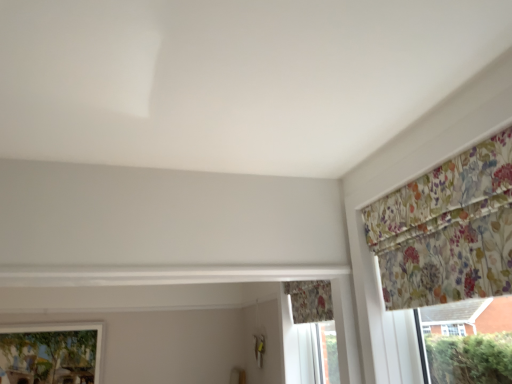
Question: Is floral fabric curtain at lower center, positioned as the 2th curtain in front-to-back order, turned away from floral fabric curtain at upper right, positioned as the 1th curtain in top-to-bottom order?

Choices:
 (A) yes
 (B) no

Answer: (B)

Question: Is floral fabric curtain at lower center, marked as the 2th curtain in a right-to-left arrangement, thinner than floral fabric curtain at upper right, acting as the 2th curtain starting from the left?

Choices:
 (A) no
 (B) yes

Answer: (B)

Question: Does floral fabric curtain at lower center, positioned as the 2th curtain in front-to-back order, appear on the left side of floral fabric curtain at upper right, the first curtain positioned from the right?

Choices:
 (A) no
 (B) yes

Answer: (B)

Question: From a real-world perspective, is floral fabric curtain at lower center, marked as the 2th curtain in a right-to-left arrangement, under floral fabric curtain at upper right, acting as the 2th curtain starting from the left?

Choices:
 (A) no
 (B) yes

Answer: (B)

Question: Does floral fabric curtain at lower center, which ranks as the first curtain in bottom-to-top order, have a smaller size compared to floral fabric curtain at upper right, positioned as the 1th curtain in top-to-bottom order?

Choices:
 (A) yes
 (B) no

Answer: (A)

Question: From their relative heights in the image, would you say matte glass window at lower left is taller or shorter than floral fabric curtain at lower center, which is the second curtain in top-to-bottom order?

Choices:
 (A) short
 (B) tall

Answer: (B)

Question: Does point (83, 345) appear closer or farther from the camera than point (301, 312)?

Choices:
 (A) closer
 (B) farther

Answer: (B)

Question: Based on their sizes in the image, would you say matte glass window at lower left is bigger or smaller than floral fabric curtain at lower center, positioned as the 2th curtain in front-to-back order?

Choices:
 (A) small
 (B) big

Answer: (B)

Question: Based on their positions, is matte glass window at lower left located to the left or right of floral fabric curtain at lower center, positioned as the 2th curtain in front-to-back order?

Choices:
 (A) right
 (B) left

Answer: (B)

Question: From the image's perspective, is floral fabric curtain at lower center, which ranks as the 1th curtain in back-to-front order, located above or below floral fabric curtain at upper right, which ranks as the 2th curtain in back-to-front order?

Choices:
 (A) below
 (B) above

Answer: (A)

Question: Is floral fabric curtain at lower center, which ranks as the first curtain in bottom-to-top order, wider or thinner than floral fabric curtain at upper right, positioned as the 1th curtain in top-to-bottom order?

Choices:
 (A) thin
 (B) wide

Answer: (A)

Question: In terms of height, does floral fabric curtain at lower center, positioned as the 2th curtain in front-to-back order, look taller or shorter compared to floral fabric curtain at upper right, marked as the first curtain in a front-to-back arrangement?

Choices:
 (A) short
 (B) tall

Answer: (A)

Question: Is point (328, 309) positioned closer to the camera than point (461, 216)?

Choices:
 (A) farther
 (B) closer

Answer: (A)

Question: Considering the positions of matte glass window at lower left and floral fabric curtain at upper right, the 2th curtain when ordered from bottom to top, in the image, is matte glass window at lower left taller or shorter than floral fabric curtain at upper right, the 2th curtain when ordered from bottom to top,?

Choices:
 (A) tall
 (B) short

Answer: (A)

Question: From a real-world perspective, is matte glass window at lower left positioned above or below floral fabric curtain at upper right, which ranks as the 2th curtain in back-to-front order?

Choices:
 (A) below
 (B) above

Answer: (A)